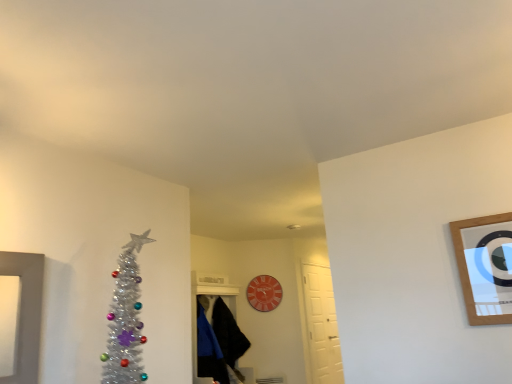
Question: Which direction should I rotate to face black fuzzy robe at center, the second robe in the front-to-back sequence, — up or down?

Choices:
 (A) down
 (B) up

Answer: (A)

Question: Is the depth of wooden-framed mirror at upper right less than that of black fuzzy robe at center, the second robe in the front-to-back sequence?

Choices:
 (A) yes
 (B) no

Answer: (A)

Question: Is there a large distance between wooden-framed mirror at upper right and black fuzzy robe at center, the first robe when ordered from back to front?

Choices:
 (A) no
 (B) yes

Answer: (B)

Question: Is wooden-framed mirror at upper right wider than black fuzzy robe at center, the second robe in the front-to-back sequence?

Choices:
 (A) yes
 (B) no

Answer: (B)

Question: Considering the relative positions of wooden-framed mirror at upper right and black fuzzy robe at center, the second robe in the front-to-back sequence, in the image provided, is wooden-framed mirror at upper right to the right of black fuzzy robe at center, the second robe in the front-to-back sequence, from the viewer's perspective?

Choices:
 (A) no
 (B) yes

Answer: (B)

Question: Is wooden-framed mirror at upper right in contact with black fuzzy robe at center, the second robe in the front-to-back sequence?

Choices:
 (A) no
 (B) yes

Answer: (A)

Question: Considering the relative sizes of wooden-framed mirror at upper right and black fuzzy robe at center, the first robe when ordered from back to front, in the image provided, is wooden-framed mirror at upper right shorter than black fuzzy robe at center, the first robe when ordered from back to front,?

Choices:
 (A) yes
 (B) no

Answer: (A)

Question: From the image's perspective, is black fuzzy robe at center, the second robe in the front-to-back sequence, below wooden-framed mirror at upper right?

Choices:
 (A) yes
 (B) no

Answer: (A)

Question: Can you confirm if black fuzzy robe at center, the first robe when ordered from back to front, is positioned to the right of wooden-framed mirror at upper right?

Choices:
 (A) yes
 (B) no

Answer: (B)

Question: Can you confirm if black fuzzy robe at center, the first robe when ordered from back to front, is thinner than wooden-framed mirror at upper right?

Choices:
 (A) no
 (B) yes

Answer: (A)

Question: Is the depth of black fuzzy robe at center, the first robe when ordered from back to front, greater than that of wooden-framed mirror at upper right?

Choices:
 (A) no
 (B) yes

Answer: (B)

Question: Does black fuzzy robe at center, the second robe in the front-to-back sequence, have a greater width compared to wooden-framed mirror at upper right?

Choices:
 (A) yes
 (B) no

Answer: (A)

Question: Is black fuzzy robe at center, the second robe in the front-to-back sequence, shorter than wooden-framed mirror at upper right?

Choices:
 (A) yes
 (B) no

Answer: (B)

Question: From the image's perspective, does black matte robe at center, which ranks as the 2th robe in back-to-front order, appear higher than white matte door at center-right?

Choices:
 (A) no
 (B) yes

Answer: (B)